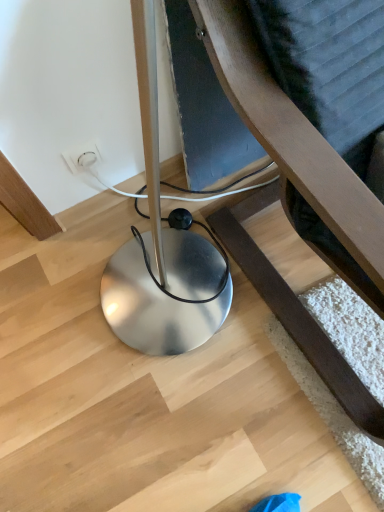
This screenshot has height=512, width=384. What are the coordinates of `metallic silver lamp at lower left` in the screenshot? It's located at (285, 194).

The width and height of the screenshot is (384, 512). What do you see at coordinates (285, 194) in the screenshot?
I see `metallic silver lamp at lower left` at bounding box center [285, 194].

Describe the element at coordinates (82, 157) in the screenshot. Image resolution: width=384 pixels, height=512 pixels. I see `white plastic outlet at center` at that location.

At what (x,y) coordinates should I click in order to perform the action: click on white plastic outlet at center. Please return your answer as a coordinate pair (x, y). The height and width of the screenshot is (512, 384). Looking at the image, I should click on (82, 157).

Find the location of a particular element. This screenshot has width=384, height=512. metallic silver lamp at lower left is located at coordinates (285, 194).

Does metallic silver lamp at lower left appear on the right side of white plastic outlet at center?

Yes, metallic silver lamp at lower left is to the right of white plastic outlet at center.

Is the position of metallic silver lamp at lower left less distant than that of white plastic outlet at center?

That is True.

Is point (327, 210) behind point (87, 165)?

No, (327, 210) is closer to viewer.

From the image's perspective, is metallic silver lamp at lower left positioned above or below white plastic outlet at center?

Based on their image positions, metallic silver lamp at lower left is located beneath white plastic outlet at center.

From a real-world perspective, is metallic silver lamp at lower left physically located above or below white plastic outlet at center?

metallic silver lamp at lower left is above white plastic outlet at center.

Does metallic silver lamp at lower left have a lesser width compared to white plastic outlet at center?

Incorrect, the width of metallic silver lamp at lower left is not less than that of white plastic outlet at center.

Considering the sizes of objects metallic silver lamp at lower left and white plastic outlet at center in the image provided, who is shorter, metallic silver lamp at lower left or white plastic outlet at center?

white plastic outlet at center is shorter.

Considering the sizes of objects metallic silver lamp at lower left and white plastic outlet at center in the image provided, who is smaller, metallic silver lamp at lower left or white plastic outlet at center?

white plastic outlet at center is smaller.

Can we say metallic silver lamp at lower left lies outside white plastic outlet at center?

metallic silver lamp at lower left lies outside white plastic outlet at center's area.

Are metallic silver lamp at lower left and white plastic outlet at center far apart?

They are positioned close to each other.

Is metallic silver lamp at lower left oriented towards white plastic outlet at center?

No, metallic silver lamp at lower left is not turned towards white plastic outlet at center.

Measure the distance between metallic silver lamp at lower left and white plastic outlet at center.

metallic silver lamp at lower left is 18.53 inches from white plastic outlet at center.

You are a GUI agent. You are given a task and a screenshot of the screen. Output one action in this format:
    pyautogui.click(x=<x>, y=<y>)
    Task: Click on the furniture below the white plastic outlet at center (from the image's perspective)
    
    Given the screenshot: What is the action you would take?
    pyautogui.click(x=285, y=194)

In the image, is white plastic outlet at center on the left side or the right side of metallic silver lamp at lower left?

white plastic outlet at center is positioned on metallic silver lamp at lower left's left side.

Considering their positions, is white plastic outlet at center located in front of or behind metallic silver lamp at lower left?

white plastic outlet at center is behind metallic silver lamp at lower left.

Considering the positions of point (88, 157) and point (256, 245), is point (88, 157) closer or farther from the camera than point (256, 245)?

Point (88, 157).

From the image's perspective, which one is positioned higher, white plastic outlet at center or metallic silver lamp at lower left?

white plastic outlet at center.

From a real-world perspective, who is located higher, white plastic outlet at center or metallic silver lamp at lower left?

In real-world perspective, metallic silver lamp at lower left is above.

Considering the sizes of objects white plastic outlet at center and metallic silver lamp at lower left in the image provided, who is thinner, white plastic outlet at center or metallic silver lamp at lower left?

white plastic outlet at center.

Is white plastic outlet at center taller or shorter than metallic silver lamp at lower left?

Considering their sizes, white plastic outlet at center has less height than metallic silver lamp at lower left.

Between white plastic outlet at center and metallic silver lamp at lower left, which one has smaller size?

white plastic outlet at center.

Is white plastic outlet at center inside the boundaries of metallic silver lamp at lower left, or outside?

white plastic outlet at center is located beyond the bounds of metallic silver lamp at lower left.

Looking at this image, is white plastic outlet at center in contact with metallic silver lamp at lower left?

No, white plastic outlet at center is not next to metallic silver lamp at lower left.

Is white plastic outlet at center positioned with its back to metallic silver lamp at lower left?

No, metallic silver lamp at lower left is not at the back of white plastic outlet at center.

How different are the orientations of white plastic outlet at center and metallic silver lamp at lower left in degrees?

The facing directions of white plastic outlet at center and metallic silver lamp at lower left are 0.81 degrees apart.

Identify the location of electric outlet that appears below the metallic silver lamp at lower left (from a real-world perspective). (82, 157).

Find the location of a particular element. electric outlet located underneath the metallic silver lamp at lower left (from a real-world perspective) is located at coordinates (82, 157).

Where is `electric outlet on the left of metallic silver lamp at lower left`? The image size is (384, 512). electric outlet on the left of metallic silver lamp at lower left is located at coordinates (x=82, y=157).